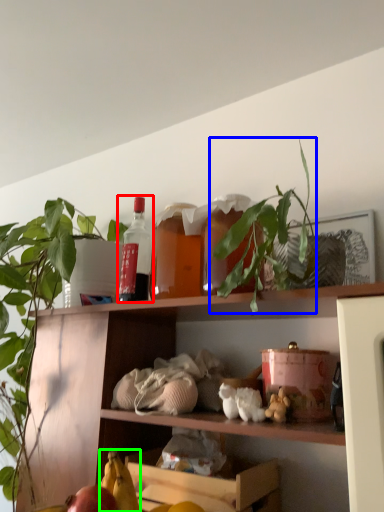
Question: Which object is positioned farthest from bottle (highlighted by a red box)? Select from plant (highlighted by a blue box) and banana (highlighted by a green box).

Choices:
 (A) plant
 (B) banana

Answer: (B)